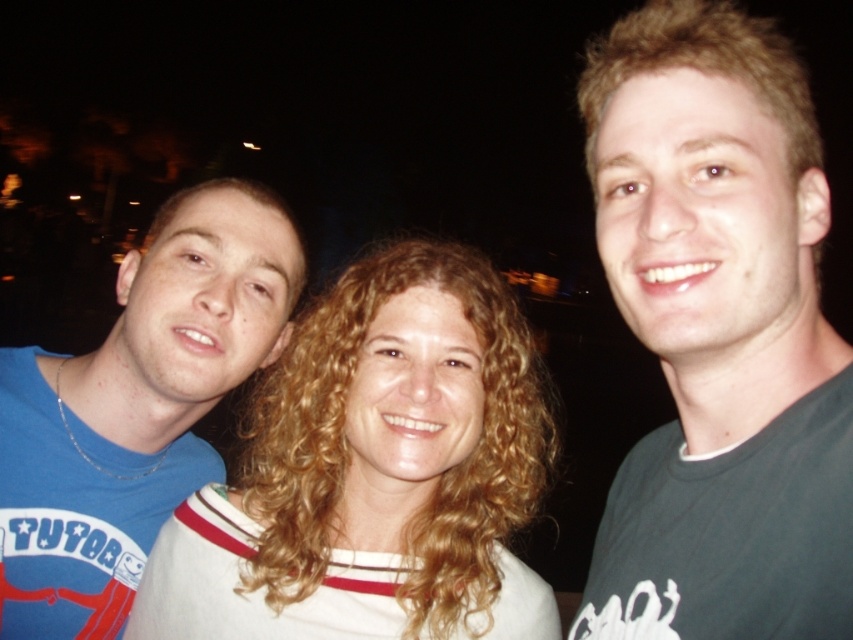
Question: Does dark green t-shirt at center have a larger size compared to curly blonde hair at center?

Choices:
 (A) no
 (B) yes

Answer: (A)

Question: Based on their relative distances, which object is nearer to the blue t-shirt at left?

Choices:
 (A) curly blonde hair at center
 (B) blonde curly hair at right
 (C) dark green t-shirt at center

Answer: (A)

Question: Does dark green t-shirt at center have a larger size compared to curly blonde hair at center?

Choices:
 (A) yes
 (B) no

Answer: (B)

Question: Which point appears farthest from the camera in this image?

Choices:
 (A) (309, 445)
 (B) (799, 122)
 (C) (16, 616)
 (D) (706, 145)

Answer: (C)

Question: Which object is the closest to the curly blonde hair at center?

Choices:
 (A) dark green t-shirt at center
 (B) blue t-shirt at left
 (C) blonde curly hair at right

Answer: (B)

Question: Does curly blonde hair at center appear on the right side of blue t-shirt at left?

Choices:
 (A) no
 (B) yes

Answer: (B)